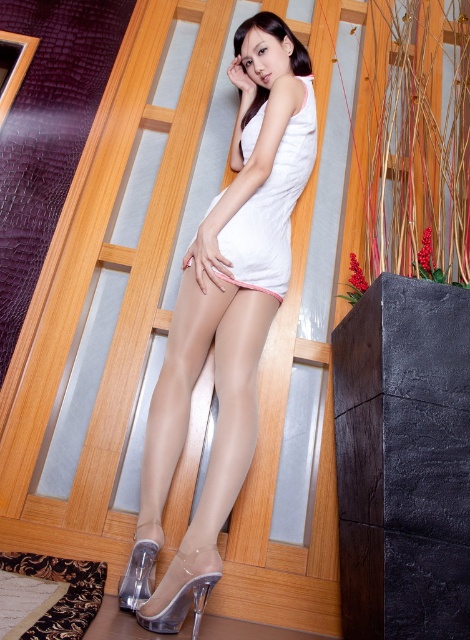
Is clear plastic high-heeled shoe at lower center taller than pink fabric at center?

Yes, clear plastic high-heeled shoe at lower center is taller than pink fabric at center.

Which is in front, point (124, 588) or point (286, 273)?

Point (124, 588) is in front.

Is point (131, 564) positioned before point (247, 278)?

Yes, point (131, 564) is closer to viewer.

Locate an element on the screen. The image size is (470, 640). clear plastic high-heeled shoe at lower center is located at coordinates (140, 566).

Consider the image. Does transparent plastic high-heeled shoe at lower center come behind clear plastic high-heeled shoe at lower center?

No.

Is transparent plastic high-heeled shoe at lower center wider than clear plastic high-heeled shoe at lower center?

Yes, transparent plastic high-heeled shoe at lower center is wider than clear plastic high-heeled shoe at lower center.

Does point (198, 557) lie in front of point (148, 568)?

Yes, it is in front of point (148, 568).

Identify the location of transparent plastic high-heeled shoe at lower center. The height and width of the screenshot is (640, 470). (181, 592).

From the picture: Which of these two, transparent plastic high-heeled shoe at lower center or pink fabric at center, stands taller?

With more height is transparent plastic high-heeled shoe at lower center.

What do you see at coordinates (181, 592) in the screenshot?
I see `transparent plastic high-heeled shoe at lower center` at bounding box center [181, 592].

Is point (211, 573) behind point (252, 253)?

No.

At what (x,y) coordinates should I click in order to perform the action: click on transparent plastic high-heeled shoe at lower center. Please return your answer as a coordinate pair (x, y). This screenshot has width=470, height=640. Looking at the image, I should click on (181, 592).